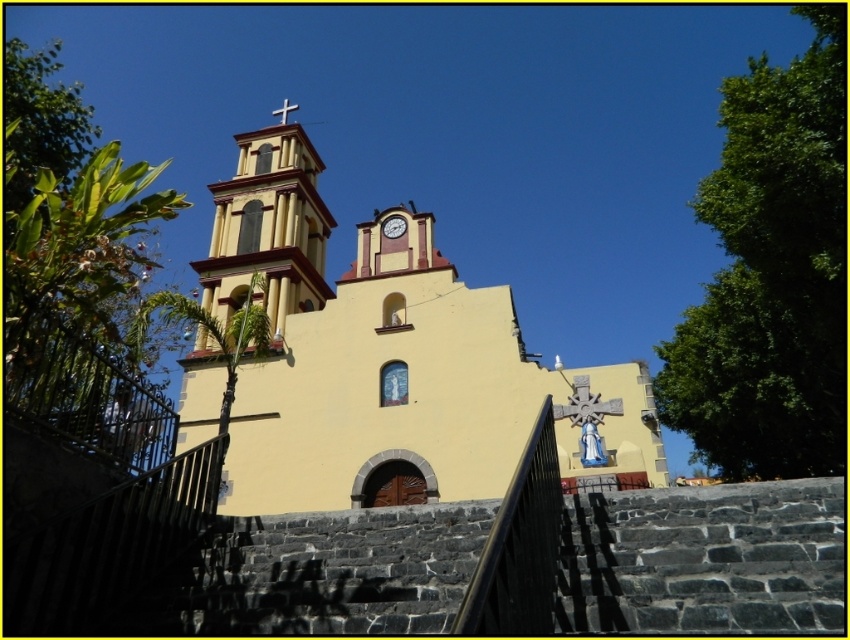
Which of these two, green leafy tree at upper right or metallic cross at upper center, stands shorter?

metallic cross at upper center

Is point (805, 90) closer to camera compared to point (281, 124)?

Yes, it is in front of point (281, 124).

Where is `green leafy tree at upper right`? green leafy tree at upper right is located at coordinates (769, 273).

Which is above, yellow matte church at center or white glossy clock at upper center?

white glossy clock at upper center

Does point (378, 499) come in front of point (398, 225)?

That is True.

This screenshot has height=640, width=850. Find the location of `yellow matte church at center`. yellow matte church at center is located at coordinates (391, 362).

Measure the distance from yellow stucco bell tower at upper left to metallic cross at upper center.

yellow stucco bell tower at upper left and metallic cross at upper center are 76.37 feet apart from each other.

Can you confirm if yellow stucco bell tower at upper left is wider than metallic cross at upper center?

Incorrect, yellow stucco bell tower at upper left's width does not surpass metallic cross at upper center's.

Is point (219, 253) positioned in front of point (282, 113)?

Yes, it is.

The width and height of the screenshot is (850, 640). I want to click on yellow stucco bell tower at upper left, so click(268, 228).